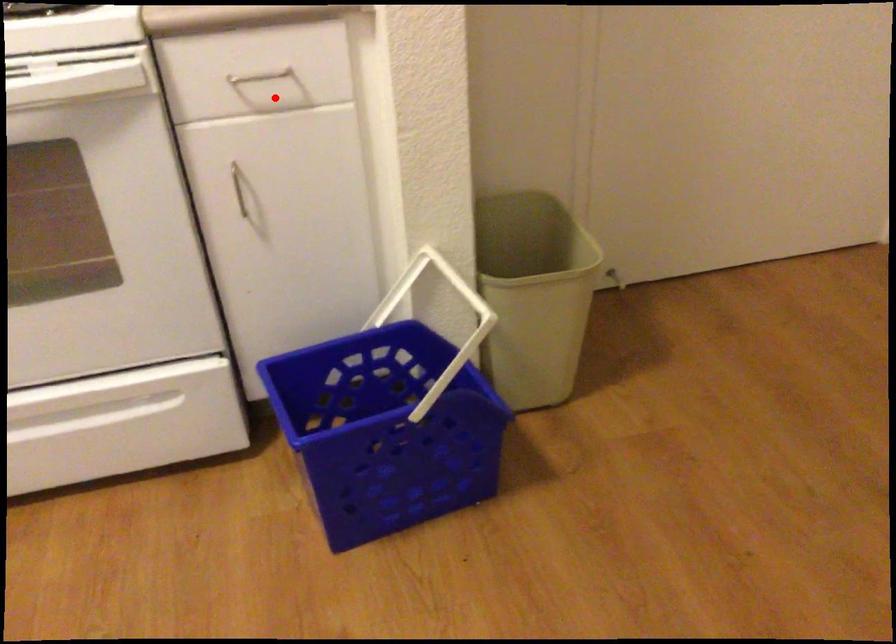
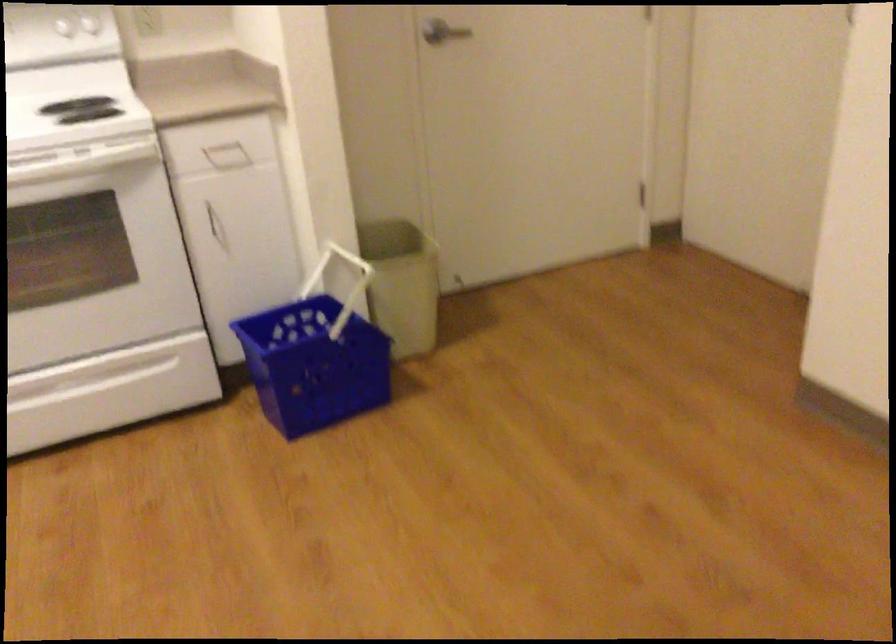
Question: I am providing you with two images of the same scene from different viewpoints. Image1 has a red point marked. In image2, the corresponding 3D location appears at what relative position? Reply with the corresponding letter.

Choices:
 (A) Closer
 (B) Farther

Answer: (B)